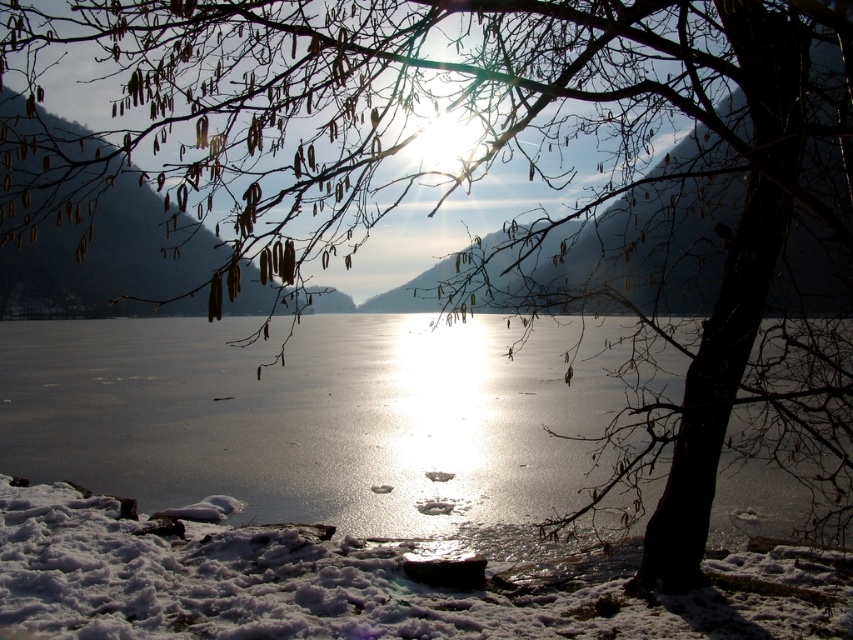
You are standing on the frozen lake and want to cross to the other side. There is a transparent ice area marked by point (311, 417). Is this area safe to walk on?

The point (311, 417) indicates transparent ice at center, which may not be safe to walk on as transparent ice can be thin and prone to breaking.

You are an ice skater planning to glide across the frozen lake. You notice the transparent ice at center and the white fluffy snow at lower left. Which surface would provide a safer path for ice skating, and why?

The transparent ice at center is safer for ice skating because it has a larger size compared to the white fluffy snow at lower left, indicating it is thicker and more stable.

You are planning to walk across the frozen lake and notice the transparent ice at center and the white fluffy snow at lower left. Which surface would you consider safer for walking, and why?

The transparent ice at center is likely safer for walking because transparent ice is usually thicker and more solid compared to the white fluffy snow at lower left, which might be less compacted and more prone to sinking.